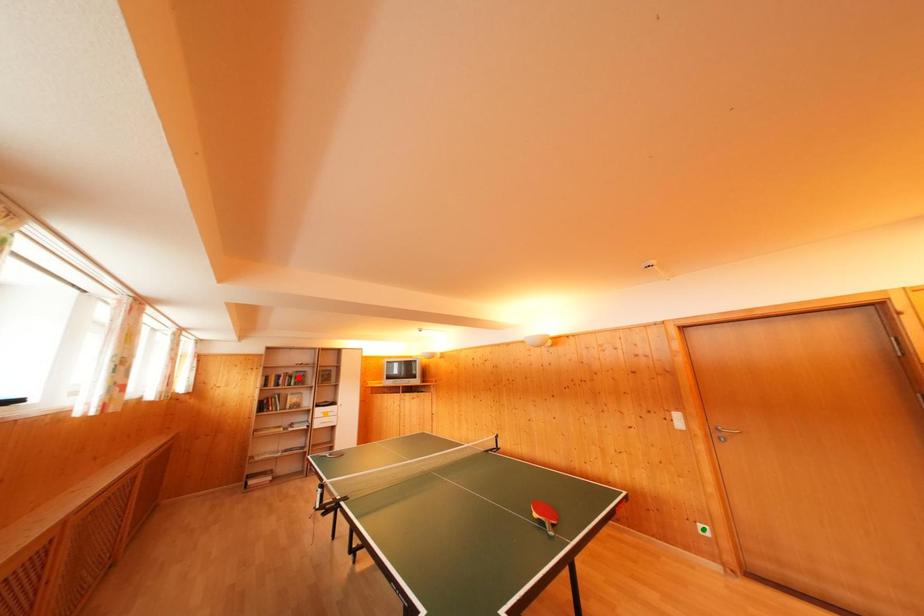
Order these from nearest to farthest:
red point | orange point | green point

green point < orange point < red point